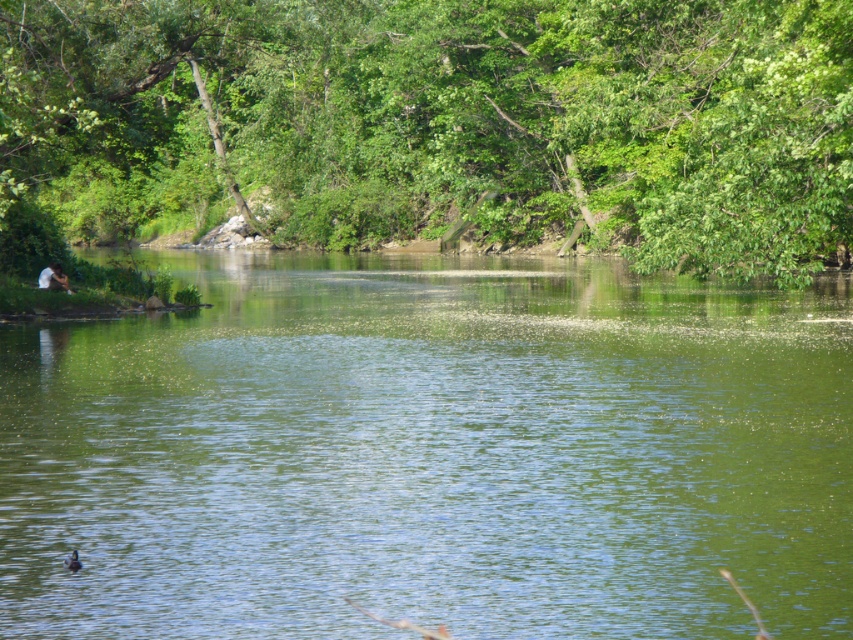
Does green leafy tree at upper center come behind brown fuzzy duck at lower left?

Yes, green leafy tree at upper center is behind brown fuzzy duck at lower left.

Which is behind, point (828, 58) or point (62, 563)?

Point (828, 58)

You are a GUI agent. You are given a task and a screenshot of the screen. Output one action in this format:
    pyautogui.click(x=<x>, y=<y>)
    Task: Click on the green leafy tree at upper center
    The image size is (853, 640).
    Given the screenshot: What is the action you would take?
    pyautogui.click(x=444, y=120)

Can you confirm if green smooth water at center is wider than brown fuzzy duck at lower left?

Yes, green smooth water at center is wider than brown fuzzy duck at lower left.

Does green smooth water at center have a lesser width compared to brown fuzzy duck at lower left?

No.

Locate an element on the screen. This screenshot has height=640, width=853. green smooth water at center is located at coordinates (431, 454).

Can you confirm if green smooth water at center is wider than green leafy tree at upper center?

No.

Can you confirm if green smooth water at center is bigger than green leafy tree at upper center?

No.

Is point (248, 312) farther from viewer compared to point (819, 58)?

Yes, point (248, 312) is farther from viewer.

You are a GUI agent. You are given a task and a screenshot of the screen. Output one action in this format:
    pyautogui.click(x=<x>, y=<y>)
    Task: Click on the green smooth water at center
    Image resolution: width=853 pixels, height=640 pixels.
    Given the screenshot: What is the action you would take?
    pyautogui.click(x=431, y=454)